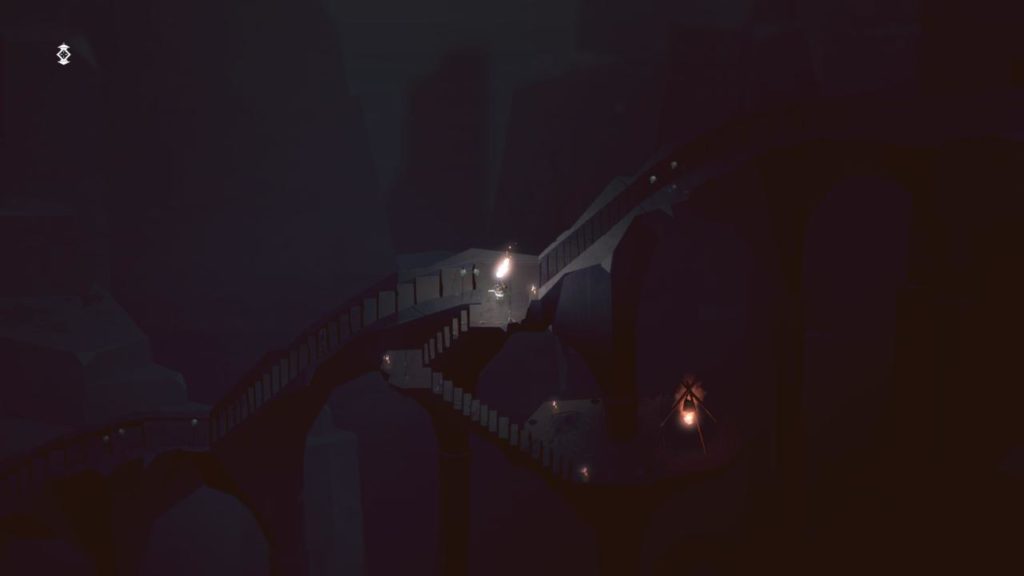
Locate an element on the screen. The height and width of the screenshot is (576, 1024). stairs is located at coordinates (585, 244), (421, 287), (443, 350), (467, 401).